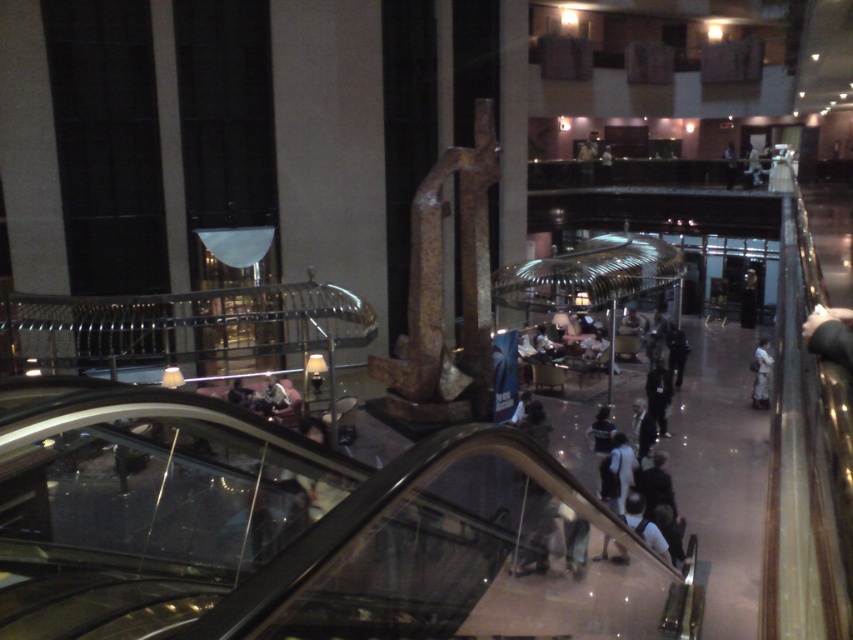
You are a person standing in the scene and want to pick up both the dark gray fabric pants at lower right and the dark gray fabric jacket at center. Which item should you reach for first to grab the closest one?

The dark gray fabric pants at lower right is closer to you than the dark gray fabric jacket at center, so you should reach for the dark gray fabric pants at lower right first.

You are a customer in this upscale public space and you see both the white fabric bag at lower right and the dark gray fabric pants at center. Which item is placed above the other?

The white fabric bag at lower right is positioned over the dark gray fabric pants at center.